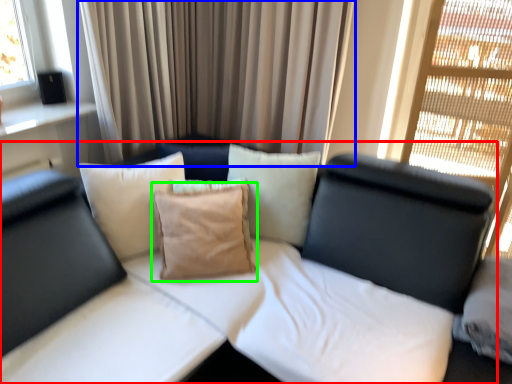
Question: Which object is the farthest from studio couch (highlighted by a red box)? Choose among these: curtain (highlighted by a blue box) or pillow (highlighted by a green box).

Choices:
 (A) curtain
 (B) pillow

Answer: (A)